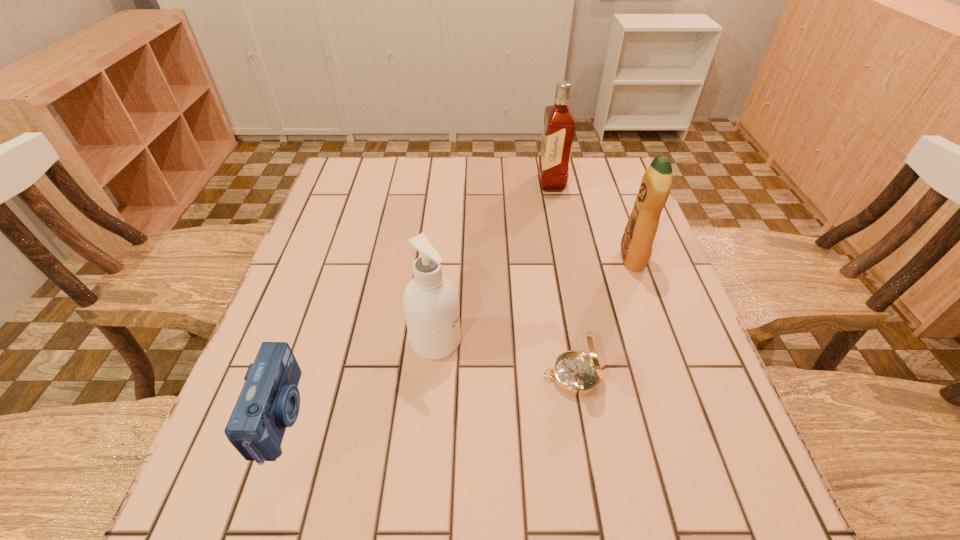
Locate an element on the screen. Image resolution: width=960 pixels, height=540 pixels. empty location between the second farthest object and the compass is located at coordinates (603, 317).

What are the coordinates of `unoccupied area between the detergent and the second object from left to right` in the screenshot? It's located at (534, 299).

Identify the location of free space between the liquor and the second object from left to right. The image size is (960, 540). (493, 262).

You are a GUI agent. You are given a task and a screenshot of the screen. Output one action in this format:
    pyautogui.click(x=<x>, y=<y>)
    Task: Click on the free space between the compass and the liquor
    
    Given the screenshot: What is the action you would take?
    pyautogui.click(x=563, y=279)

Locate an element on the screen. free space between the second farthest object and the liquor is located at coordinates (591, 220).

Identify the location of free space between the rightmost object and the second object from left to right. (534, 299).

Choose which object is the nearest neighbor to the detergent. Please provide its 2D coordinates. Your answer should be formatted as a tuple, i.e. [(x, y)], where the tuple contains the x and y coordinates of a point satisfying the conditions above.

[(559, 125)]

Locate an element on the screen. object that is the fourth closest one to the compass is located at coordinates (559, 125).